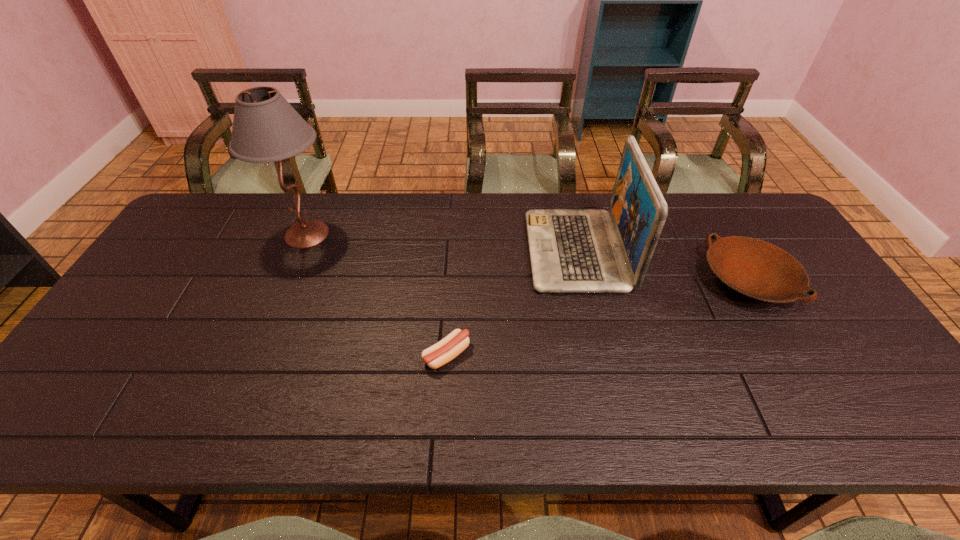
Locate an element on the screen. free spot located on the screen of the second tallest object is located at coordinates (402, 251).

Where is `vacant space located 0.240m on the screen of the second tallest object`? The height and width of the screenshot is (540, 960). vacant space located 0.240m on the screen of the second tallest object is located at coordinates (449, 251).

You are a GUI agent. You are given a task and a screenshot of the screen. Output one action in this format:
    pyautogui.click(x=<x>, y=<y>)
    Task: Click on the vacant space located 0.160m on the back of the rightmost object
    The height and width of the screenshot is (540, 960).
    Given the screenshot: What is the action you would take?
    pyautogui.click(x=711, y=216)

This screenshot has width=960, height=540. Identify the location of vacant space situated 0.290m on the left of the third object from right to left. (303, 355).

The height and width of the screenshot is (540, 960). What are the coordinates of `table lamp that is at the far edge` in the screenshot? It's located at (266, 128).

I want to click on laptop computer positioned at the far edge, so click(572, 250).

This screenshot has width=960, height=540. What are the coordinates of `object that is positioned at the right edge` in the screenshot? It's located at (757, 269).

Find the location of a particular element. free space at the far edge is located at coordinates (433, 235).

The height and width of the screenshot is (540, 960). In the image, there is a desktop. What are the coordinates of `vacant space at the near edge` in the screenshot? It's located at (143, 417).

At what (x,y) coordinates should I click in order to perform the action: click on vacant space at the left edge of the desktop. Please return your answer as a coordinate pair (x, y). This screenshot has height=540, width=960. Looking at the image, I should click on coord(120,394).